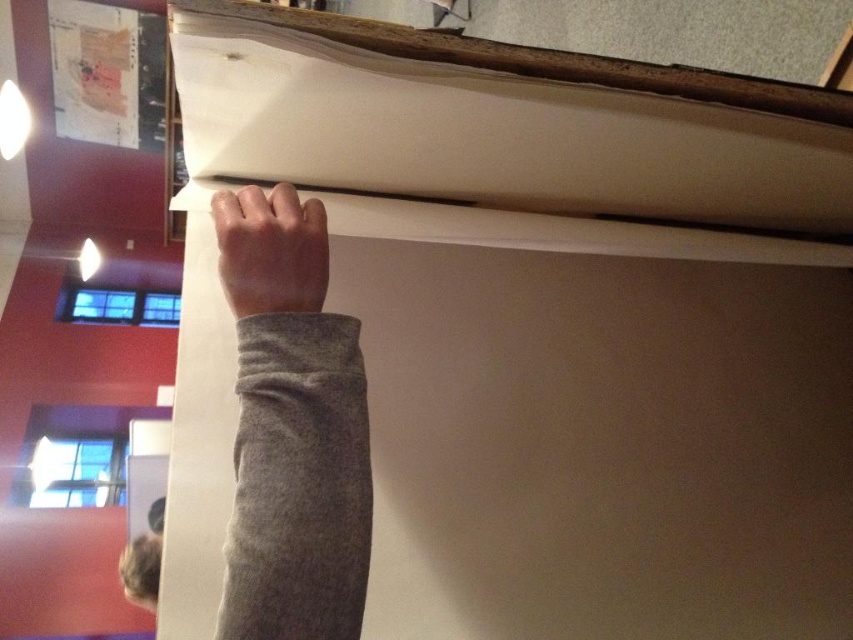
Does point (236, 212) come farther from viewer compared to point (282, 285)?

That is True.

Which is more to the left, gray fleece arm at upper center or smooth gray hand at upper center?

smooth gray hand at upper center

Where is `gray fleece arm at upper center`? The height and width of the screenshot is (640, 853). gray fleece arm at upper center is located at coordinates (292, 428).